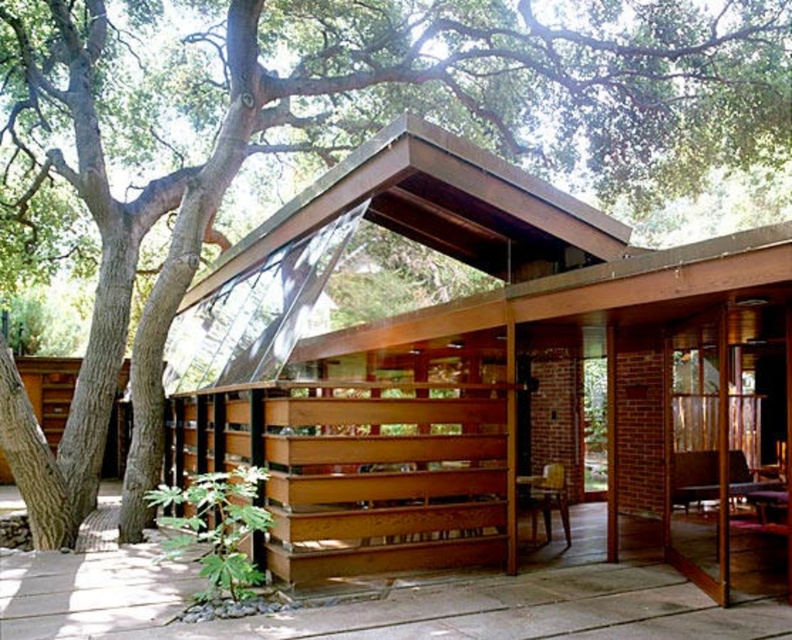
Question: Among these objects, which one is nearest to the camera?

Choices:
 (A) wooden chair at center
 (B) brown wooden deck at lower center

Answer: (B)

Question: Is the position of brown wooden deck at lower center more distant than that of wooden chair at center?

Choices:
 (A) yes
 (B) no

Answer: (B)

Question: Is brown wooden deck at lower center to the right of wooden chair at center from the viewer's perspective?

Choices:
 (A) yes
 (B) no

Answer: (B)

Question: Which point is closer to the camera?

Choices:
 (A) brown wooden deck at lower center
 (B) wooden chair at center

Answer: (A)

Question: Observing the image, what is the correct spatial positioning of brown wooden deck at lower center in reference to wooden chair at center?

Choices:
 (A) above
 (B) below

Answer: (B)